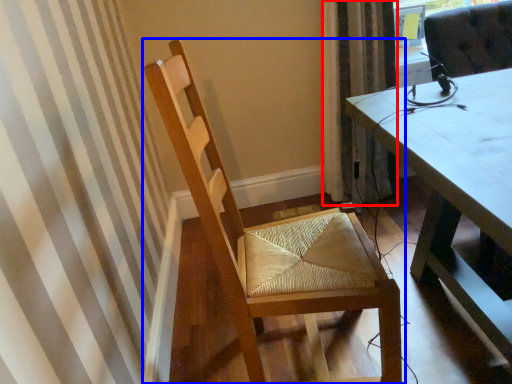
Question: Which point is closer to the camera, curtain (highlighted by a red box) or chair (highlighted by a blue box)?

Choices:
 (A) curtain
 (B) chair

Answer: (B)